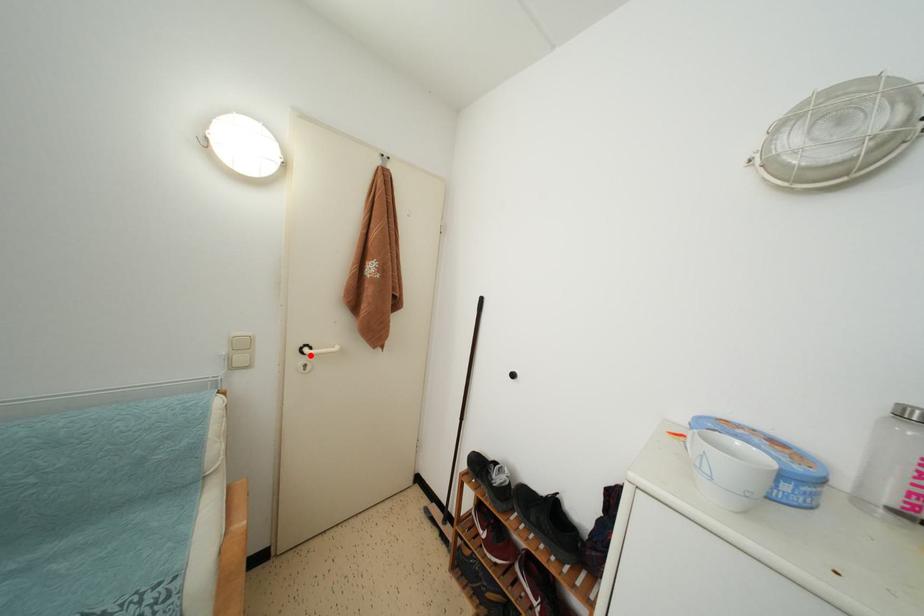
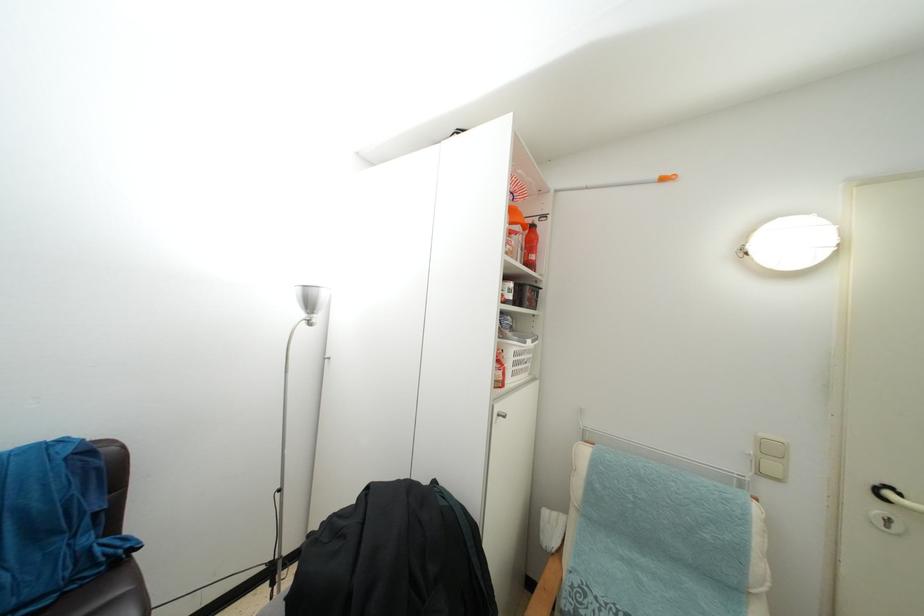
In the second image, find the point that corresponds to the highlighted location in the first image.

(893, 500)